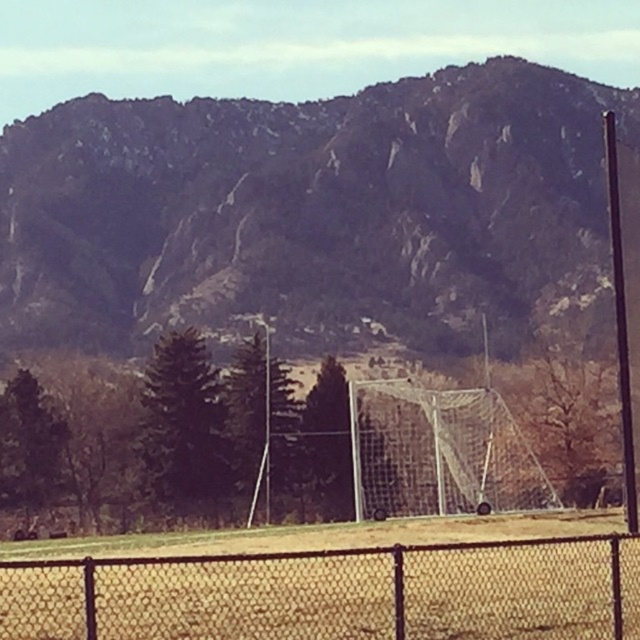
What are the coordinates of the rugged rock mountain at upper center in the image?

The rugged rock mountain at upper center is located at coordinates [305,205].